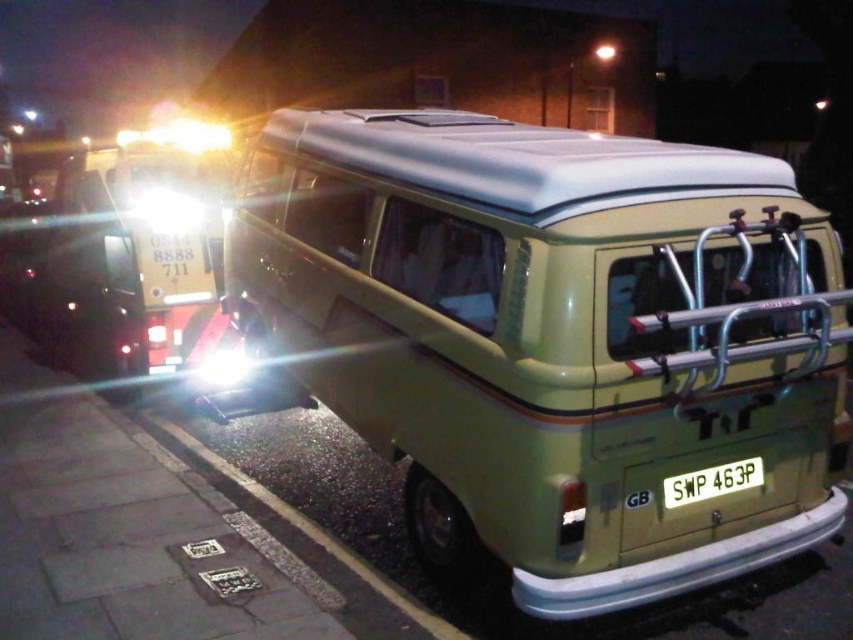
Does matte green van at center have a greater height compared to white plastic license plate at center?

Indeed, matte green van at center has a greater height compared to white plastic license plate at center.

Can you confirm if matte green van at center is bigger than white plastic license plate at center?

Correct, matte green van at center is larger in size than white plastic license plate at center.

Is point (763, 349) positioned behind point (663, 486)?

No, it is in front of (663, 486).

You are a GUI agent. You are given a task and a screenshot of the screen. Output one action in this format:
    pyautogui.click(x=<x>, y=<y>)
    Task: Click on the matte green van at center
    
    Given the screenshot: What is the action you would take?
    pyautogui.click(x=556, y=339)

Image resolution: width=853 pixels, height=640 pixels. What do you see at coordinates (556, 339) in the screenshot? I see `matte green van at center` at bounding box center [556, 339].

Is matte green van at center shorter than matte white headlight at upper left?

Incorrect, matte green van at center's height does not fall short of matte white headlight at upper left's.

Is point (703, 284) behind point (137, 195)?

No, it is not.

I want to click on matte green van at center, so click(x=556, y=339).

Does white plastic license plate at center appear under matte white headlight at upper left?

Yes.

How distant is white plastic license plate at center from matte white headlight at upper left?

white plastic license plate at center and matte white headlight at upper left are 6.07 meters apart from each other.

Who is more distant from viewer, (697, 486) or (196, 209)?

The point (196, 209) is more distant.

What are the coordinates of `white plastic license plate at center` in the screenshot? It's located at (712, 481).